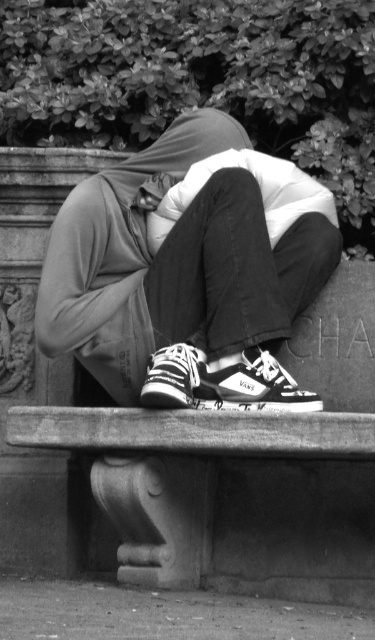
Question: Is matte black hoodie at center further to camera compared to smooth stone bench at center?

Choices:
 (A) yes
 (B) no

Answer: (B)

Question: Can you confirm if matte black hoodie at center is positioned to the left of smooth stone bench at center?

Choices:
 (A) no
 (B) yes

Answer: (B)

Question: Observing the image, what is the correct spatial positioning of matte black hoodie at center in reference to smooth stone bench at center?

Choices:
 (A) below
 (B) above

Answer: (B)

Question: Among these objects, which one is nearest to the camera?

Choices:
 (A) matte black hoodie at center
 (B) smooth stone bench at center

Answer: (A)

Question: Among these points, which one is nearest to the camera?

Choices:
 (A) (214, 192)
 (B) (238, 531)

Answer: (A)